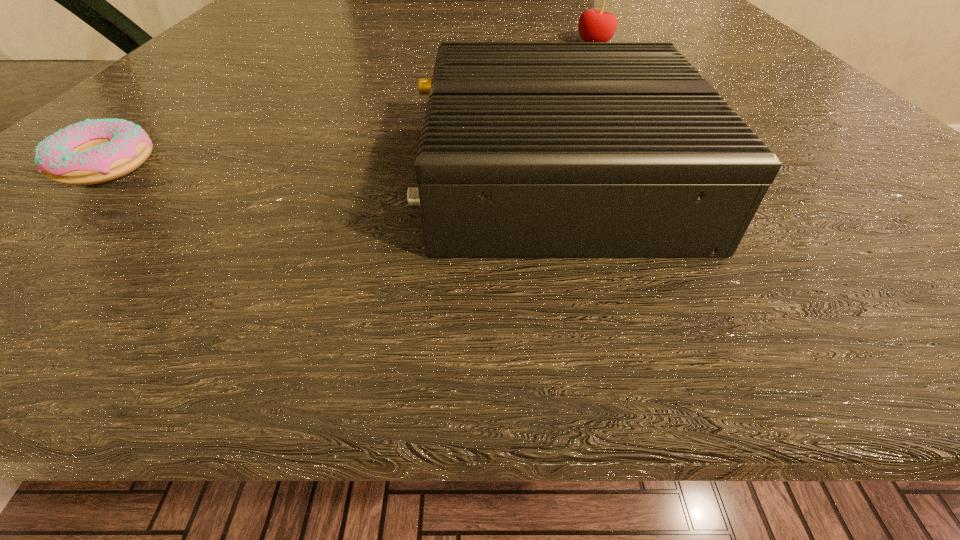
Locate which object ranks second in proximity to the doughnut. Please provide its 2D coordinates. Your answer should be formatted as a tuple, i.e. [(x, y)], where the tuple contains the x and y coordinates of a point satisfying the conditions above.

[(595, 25)]

Identify which object is located as the nearest to the shortest object. Please provide its 2D coordinates. Your answer should be formatted as a tuple, i.e. [(x, y)], where the tuple contains the x and y coordinates of a point satisfying the conditions above.

[(528, 149)]

Locate an element on the screen. This screenshot has width=960, height=540. vacant space that satisfies the following two spatial constraints: 1. on the front side of the tallest object; 2. on the back panel of the second shortest object is located at coordinates (669, 178).